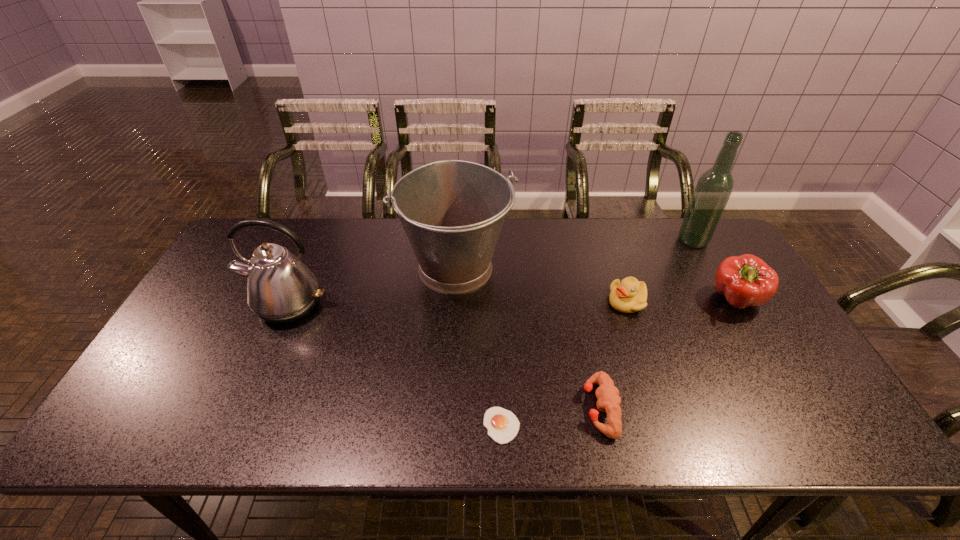
Find the location of `liquor`. liquor is located at coordinates (714, 187).

The width and height of the screenshot is (960, 540). I want to click on bucket, so click(x=452, y=211).

This screenshot has width=960, height=540. Identify the location of the leftmost object. (281, 289).

Locate an element on the screen. Image resolution: width=960 pixels, height=540 pixels. pepper is located at coordinates (746, 280).

This screenshot has height=540, width=960. In order to click on duckling in this screenshot , I will do `click(629, 295)`.

I want to click on the fifth object from left to right, so click(x=629, y=295).

Where is `the second shortest object`? The height and width of the screenshot is (540, 960). the second shortest object is located at coordinates (607, 394).

At what (x,y) coordinates should I click in order to perform the action: click on the fourth object from right to left. Please return your answer as a coordinate pair (x, y). The image size is (960, 540). Looking at the image, I should click on (607, 394).

Locate an element on the screen. The width and height of the screenshot is (960, 540). the shortest object is located at coordinates (503, 426).

Locate an element on the screen. vacant space located 0.380m on the left of the tallest object is located at coordinates (564, 240).